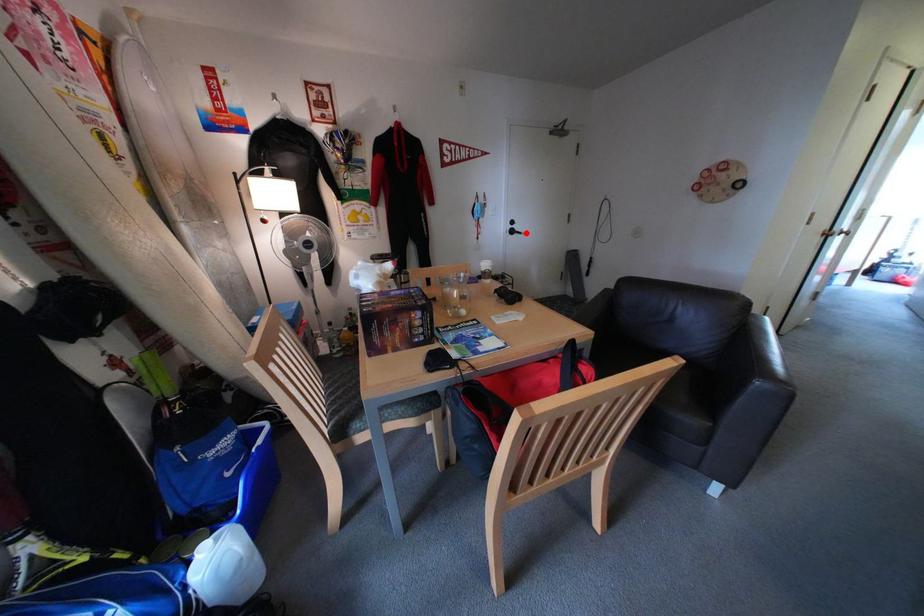
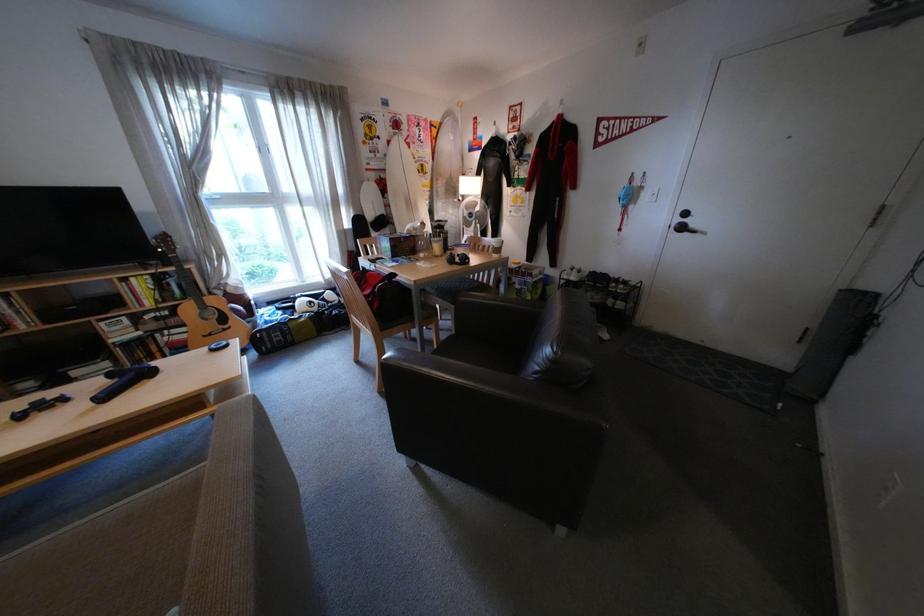
Locate, in the second image, the point that corresponds to the highlighted location in the first image.

(696, 229)